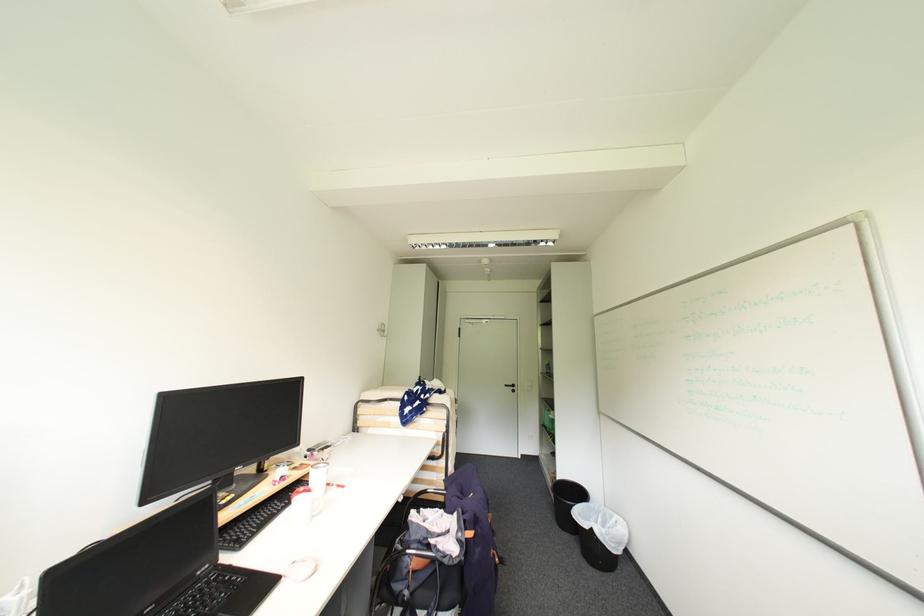
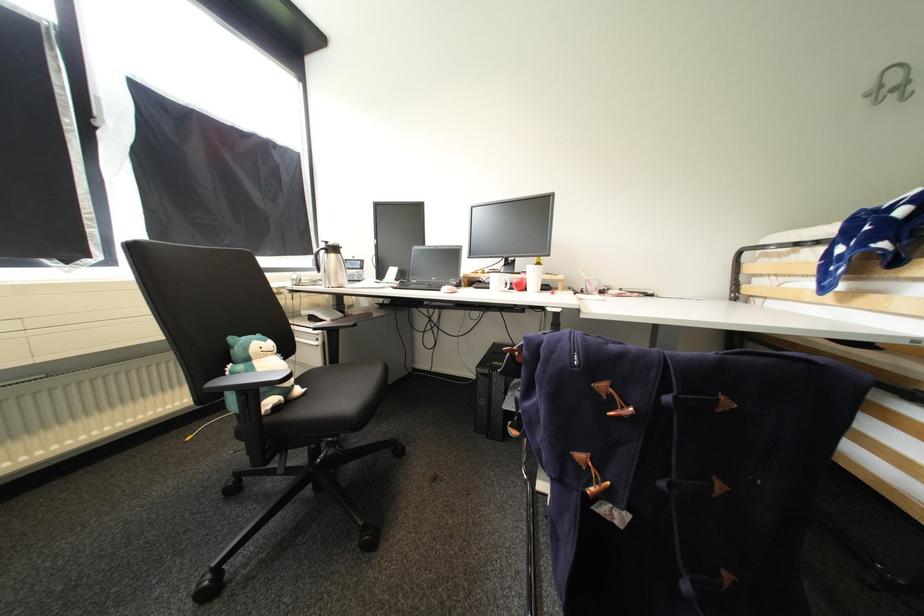
Find the pixel in the second image that matches point 390,331 in the first image.

(912, 84)